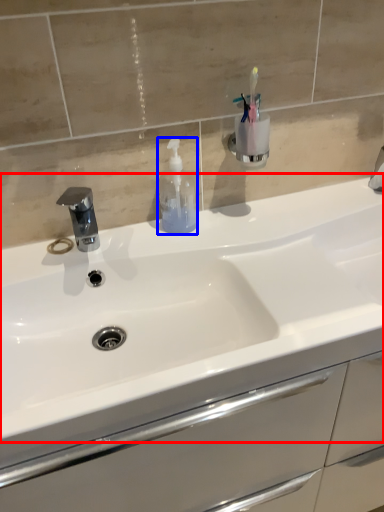
Question: Which of the following is the closest to the observer, sink (highlighted by a red box) or soap dispenser (highlighted by a blue box)?

Choices:
 (A) sink
 (B) soap dispenser

Answer: (A)